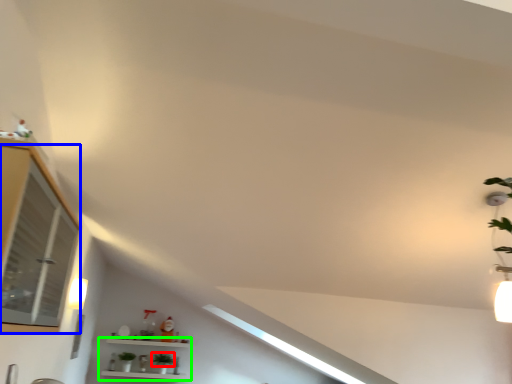
Question: Which object is the farthest from plant (highlighted by a red box)? Choose among these: window (highlighted by a blue box) or shelf (highlighted by a green box).

Choices:
 (A) window
 (B) shelf

Answer: (A)